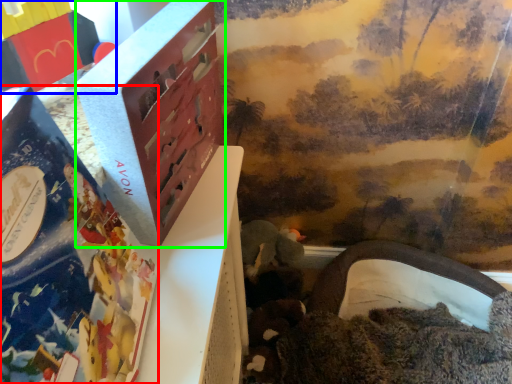
Question: Based on their relative distances, which object is nearer to book (highlighted by a red box)? Choose from toy (highlighted by a blue box) and box (highlighted by a green box).

Choices:
 (A) toy
 (B) box

Answer: (B)